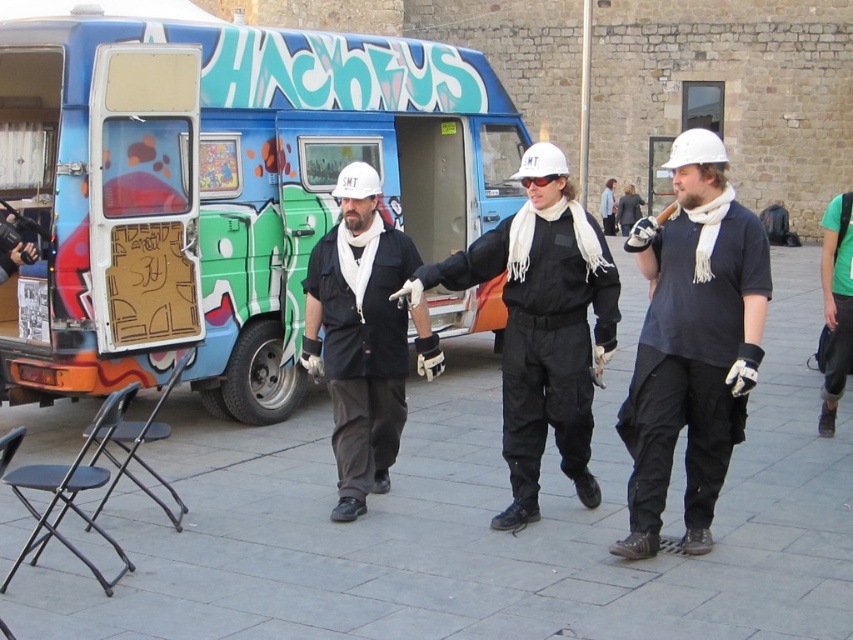
You are a photographer trying to capture a clear shot of the white matte helmet at center and the black matte jacket at center. Since you want to focus on the thinner object, which one should you adjust your camera settings for?

The white matte helmet at center is thinner than the black matte jacket at center, so you should adjust your camera settings to focus on the white matte helmet at center.

You are standing in front of the van with the SMT team members. There are two points marked on the van. One is at coordinates point (131, 358) and the other is at point (340, 240). Which point is closer to you?

Point (131, 358) is closer to you because it is further to the viewer than point (340, 240).